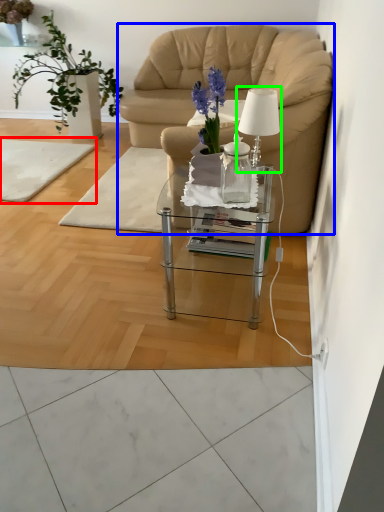
Question: Considering the real-world distances, which object is farthest from mat (highlighted by a red box)? chair (highlighted by a blue box) or table lamp (highlighted by a green box)?

Choices:
 (A) chair
 (B) table lamp

Answer: (B)